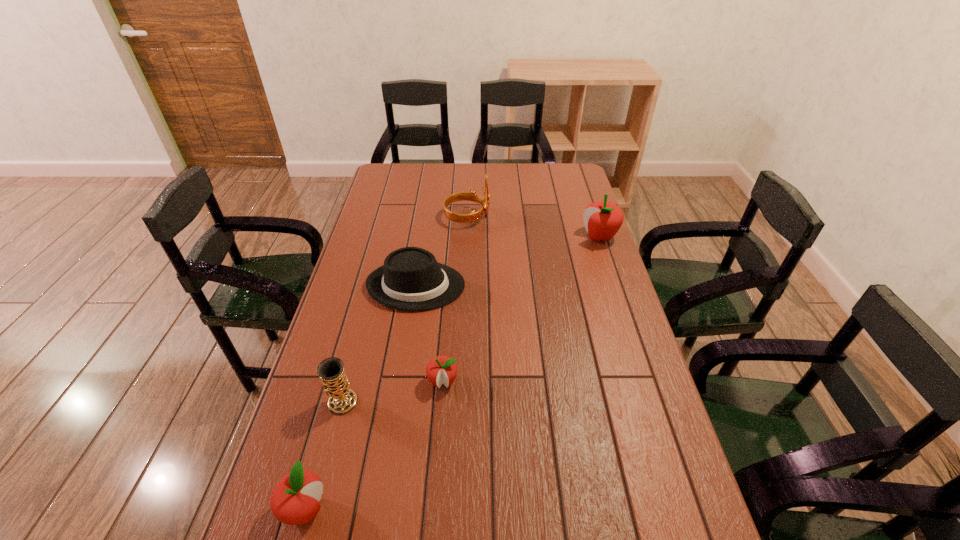
This screenshot has width=960, height=540. I want to click on vacant space located on the right of the shortest apple, so 476,382.

Where is `free point located on the front of the rightmost apple`? free point located on the front of the rightmost apple is located at coordinates (629, 326).

The image size is (960, 540). I want to click on free location located 0.290m on the front-facing side of the fedora, so pyautogui.click(x=552, y=286).

This screenshot has height=540, width=960. What are the coordinates of `free location located on the front-facing side of the tiara` in the screenshot? It's located at (555, 217).

Locate an element on the screen. This screenshot has height=540, width=960. blank area located on the back of the chalice is located at coordinates (354, 356).

Find the location of a particular element. Image resolution: width=960 pixels, height=540 pixels. object that is at the near edge is located at coordinates (294, 500).

Image resolution: width=960 pixels, height=540 pixels. I want to click on apple that is at the left edge, so click(294, 500).

Find the location of a particular element. This screenshot has height=540, width=960. fedora that is at the left edge is located at coordinates (411, 279).

Find the location of `chalice present at the left edge`. chalice present at the left edge is located at coordinates (342, 400).

Image resolution: width=960 pixels, height=540 pixels. Identify the location of object at the right edge. (602, 219).